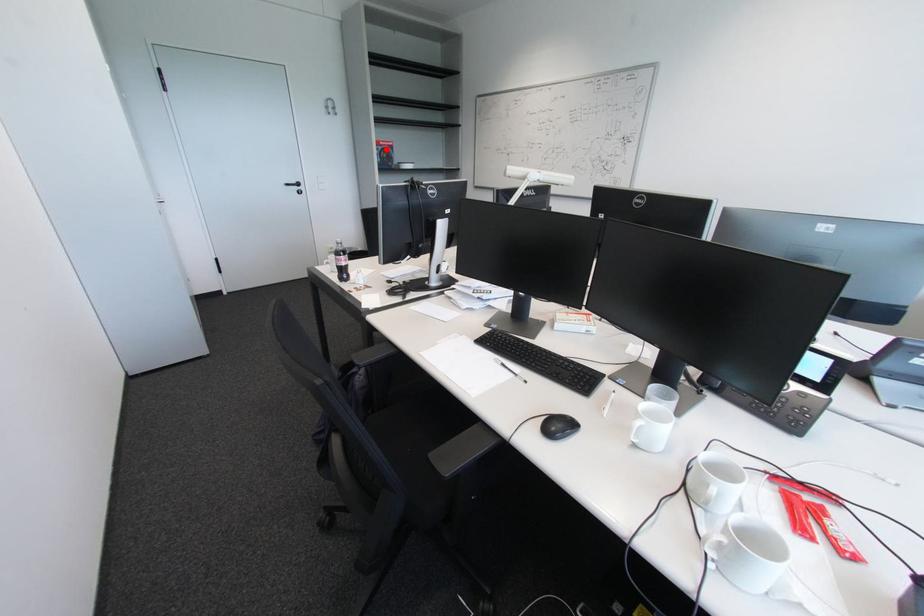
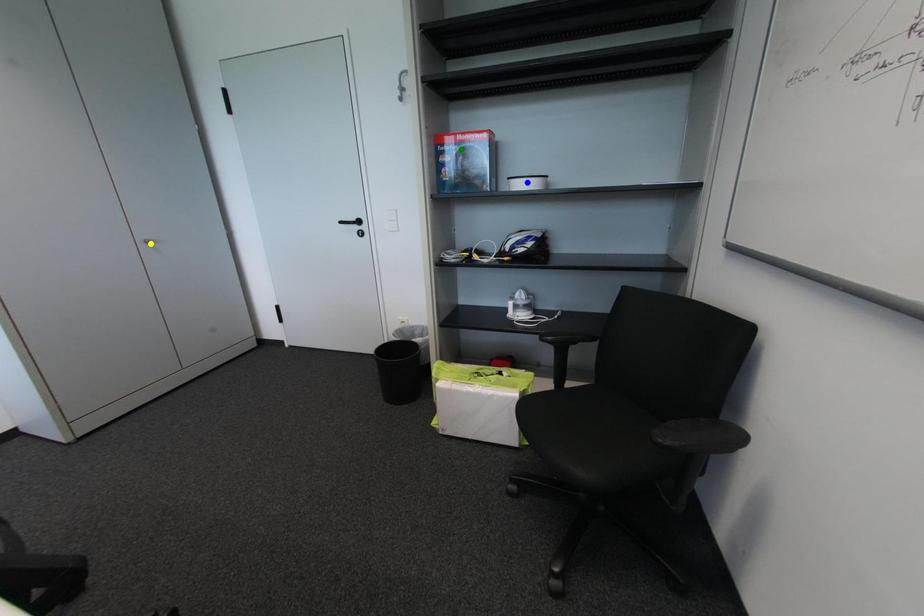
Question: I am providing you with two images of the same scene from different viewpoints. A red point is marked on the first image. You are given multiple points on the second image. Which point in image 2 is actually the same real-world point as the red point in image 1?

Choices:
 (A) blue point
 (B) yellow point
 (C) green point

Answer: (C)